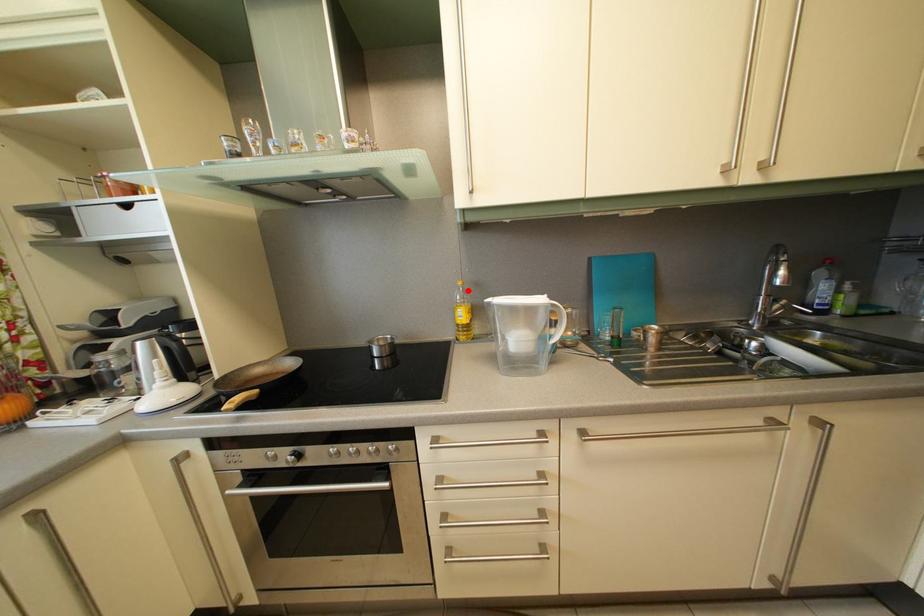
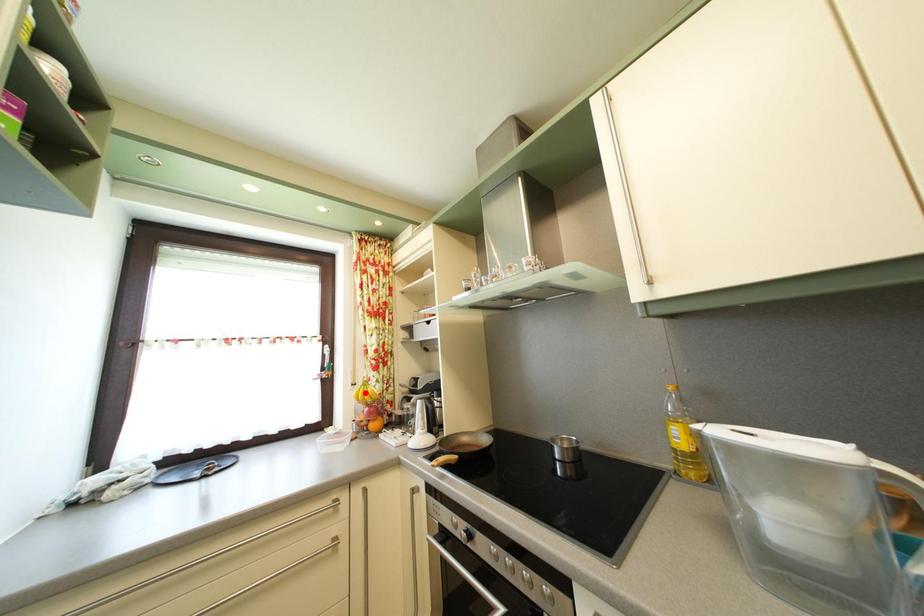
I am providing you with two images of the same scene from different viewpoints. A red point is marked on the first image and another point is marked on the second image. Does the point marked in image1 correspond to the same location as the one in image2?

No